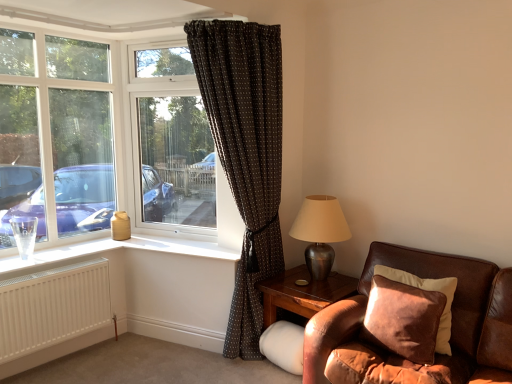
Question: Considering the relative sizes of wooden side table at lower right and white matte radiator at lower left in the image provided, is wooden side table at lower right smaller than white matte radiator at lower left?

Choices:
 (A) yes
 (B) no

Answer: (B)

Question: Would you say wooden side table at lower right contains white matte radiator at lower left?

Choices:
 (A) yes
 (B) no

Answer: (B)

Question: Could you tell me if wooden side table at lower right is turned towards white matte radiator at lower left?

Choices:
 (A) no
 (B) yes

Answer: (A)

Question: From the image's perspective, is wooden side table at lower right on top of white matte radiator at lower left?

Choices:
 (A) yes
 (B) no

Answer: (B)

Question: Is wooden side table at lower right with white matte radiator at lower left?

Choices:
 (A) yes
 (B) no

Answer: (B)

Question: Is wooden side table at lower right turned away from white matte radiator at lower left?

Choices:
 (A) no
 (B) yes

Answer: (A)

Question: Does transparent glass window at center have a greater width compared to brown corduroy pillow at lower right?

Choices:
 (A) no
 (B) yes

Answer: (A)

Question: From a real-world perspective, is transparent glass window at center positioned over brown corduroy pillow at lower right based on gravity?

Choices:
 (A) no
 (B) yes

Answer: (B)

Question: Is transparent glass window at center to the left of brown corduroy pillow at lower right from the viewer's perspective?

Choices:
 (A) no
 (B) yes

Answer: (B)

Question: Is transparent glass window at center bigger than brown corduroy pillow at lower right?

Choices:
 (A) yes
 (B) no

Answer: (A)

Question: Does transparent glass window at center have a lesser width compared to brown corduroy pillow at lower right?

Choices:
 (A) no
 (B) yes

Answer: (B)

Question: Does transparent glass window at center appear on the right side of brown corduroy pillow at lower right?

Choices:
 (A) yes
 (B) no

Answer: (B)

Question: Can you confirm if white plastic window frame at left is bigger than metallic silver table lamp at right?

Choices:
 (A) yes
 (B) no

Answer: (B)